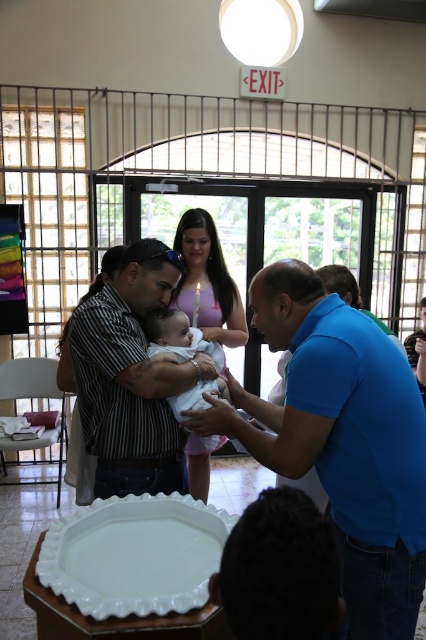
Question: Which object is positioned farthest from the striped shirt at center?

Choices:
 (A) blue smooth shirt at center
 (B) white porcelain platter at lower center
 (C) pink fabric dress at center

Answer: (C)

Question: Can you confirm if pink fabric dress at center is positioned to the right of white soft fabric baby at center?

Choices:
 (A) no
 (B) yes

Answer: (B)

Question: Which of the following is the farthest from the observer?

Choices:
 (A) (144, 568)
 (B) (195, 285)
 (C) (176, 417)
 (D) (409, 586)

Answer: (B)

Question: Can you confirm if striped shirt at center is wider than pink fabric dress at center?

Choices:
 (A) no
 (B) yes

Answer: (B)

Question: Estimate the real-world distances between objects in this image. Which object is closer to the striped shirt at center?

Choices:
 (A) white porcelain platter at lower center
 (B) pink fabric dress at center
 (C) white soft fabric baby at center

Answer: (C)

Question: Is pink fabric dress at center bigger than white soft fabric baby at center?

Choices:
 (A) no
 (B) yes

Answer: (B)